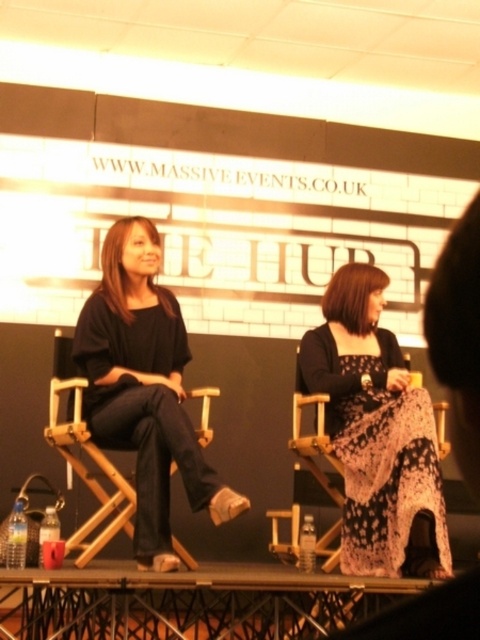
You are a photographer at the event and need to capture a clear shot of both the black lace dress at center and the matte black top at center. Based on their positions, which one is closer to the camera?

The black lace dress at center is positioned under the matte black top at center, meaning it is closer to the camera. Therefore, the black lace dress at center will appear closer in the photo.

You are standing in front of the stage at THE LIVIN event. There are two points marked on the stage floor. One is at point coordinates point [324,305] and the other at point [163,380]. Which point is closer to you?

Point [163,380] is closer to you because it is less further to the camera than point [324,305].